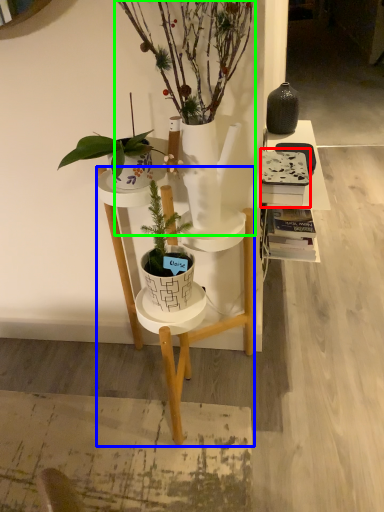
Question: Which object is positioned farthest from book (highlighted by a red box)? Select from desk (highlighted by a blue box) and houseplant (highlighted by a green box).

Choices:
 (A) desk
 (B) houseplant

Answer: (A)